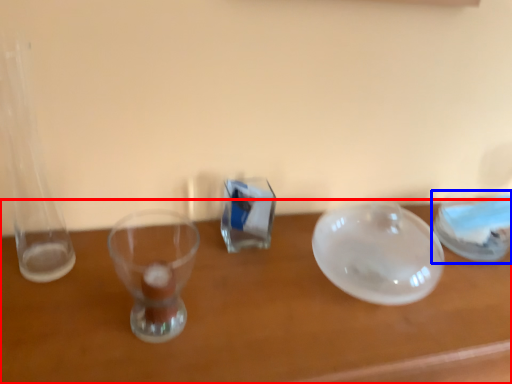
Question: Which of the following is the closest to the observer, table (highlighted by a red box) or tableware (highlighted by a blue box)?

Choices:
 (A) table
 (B) tableware

Answer: (A)